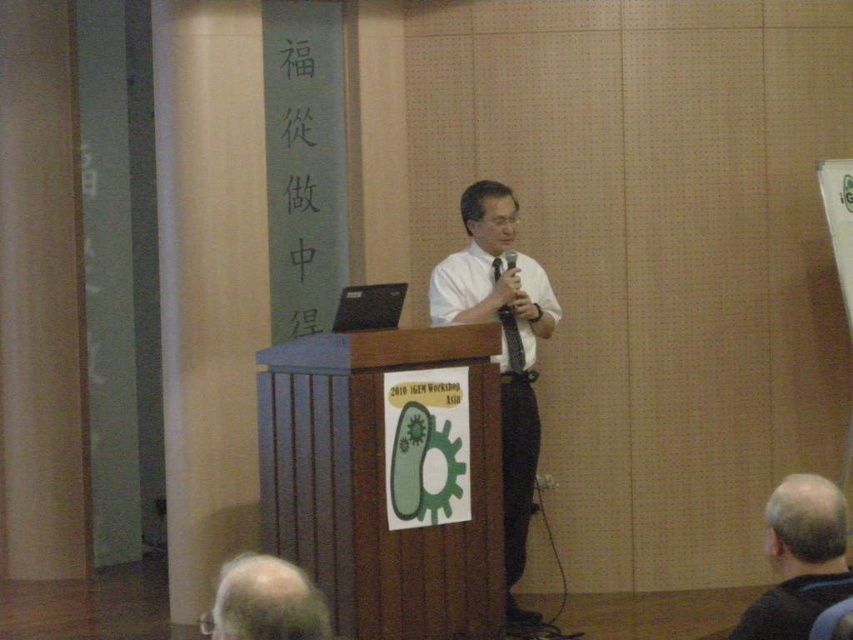
You are an event organizer who needs to ensure social distancing between the presenter and the attendee in the image. According to the current guidelines, attendees must maintain a distance of at least 6 feet apart. Is the distance between the white glossy shirt at center and gray hair at lower left compliant with the guidelines?

The white glossy shirt at center is 8.23 feet from gray hair at lower left, which exceeds the required 6 feet distance, so it is compliant with the social distancing guidelines.

You are an event organizer who needs to choose the correct shirt for a presenter based on the image. Which shirt has a narrower width between the white glossy shirt at center and the white smooth dress shirt at center?

The white glossy shirt at center has a lesser width compared to the white smooth dress shirt at center, so the white glossy shirt at center is narrower.

You are an attendee at the presentation and notice two similar shirts worn by the speaker. The speaker is wearing a white glossy shirt at center and a white smooth dress shirt at center. Which shirt is positioned to the right side of the other?

The white glossy shirt at center is positioned to the right of the white smooth dress shirt at center.